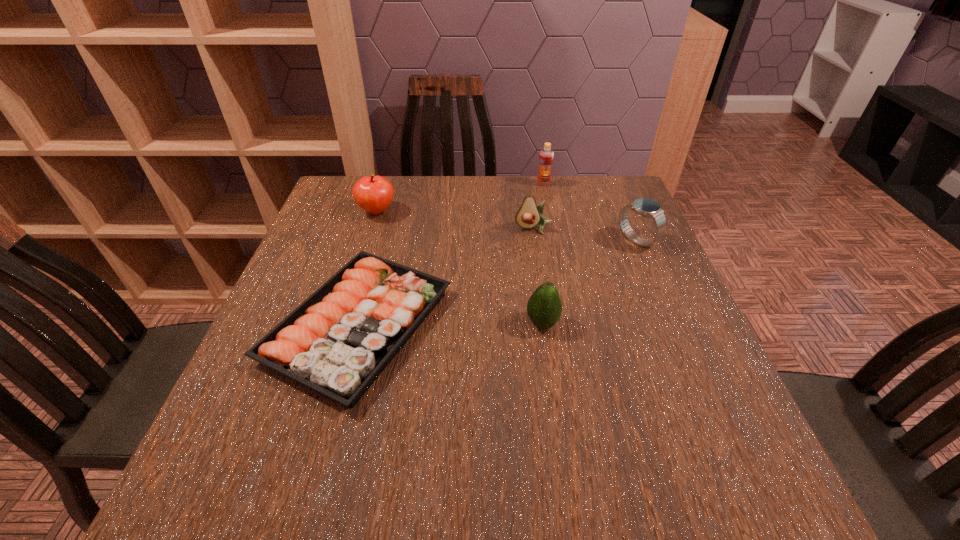
Where is `orange juice`? The height and width of the screenshot is (540, 960). orange juice is located at coordinates (546, 156).

Image resolution: width=960 pixels, height=540 pixels. I want to click on the fifth nearest object, so click(x=373, y=194).

The height and width of the screenshot is (540, 960). I want to click on watch, so click(645, 207).

The height and width of the screenshot is (540, 960). In order to click on the farther avocado in this screenshot , I will do `click(529, 215)`.

Locate an element on the screen. This screenshot has width=960, height=540. the nearer avocado is located at coordinates (544, 307).

Where is `platter`? This screenshot has width=960, height=540. platter is located at coordinates (337, 342).

Where is `free region located on the front of the orange juice`? Image resolution: width=960 pixels, height=540 pixels. free region located on the front of the orange juice is located at coordinates (557, 246).

Identify the location of blank area located on the left of the apple. 340,212.

At what (x,y) coordinates should I click in order to perform the action: click on vacant space located 0.090m on the left of the rightmost object. Please return your answer as a coordinate pair (x, y). Looking at the image, I should click on (584, 240).

Image resolution: width=960 pixels, height=540 pixels. I want to click on free location located on the seed side of the farther avocado, so click(x=539, y=261).